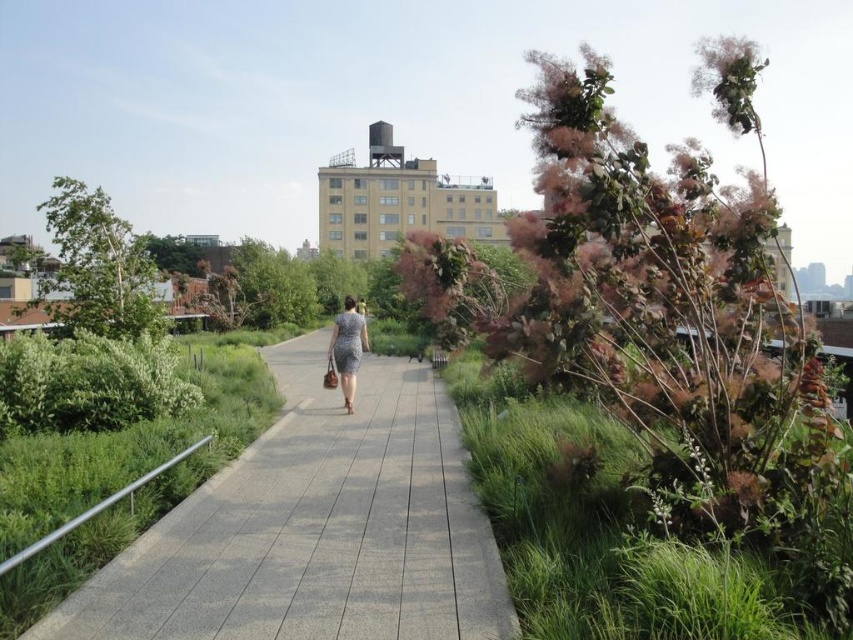
You are a gardener who wants to mow the green grass at right. You notice the patterned fabric dress at center is placed on the ground nearby. Which object is shorter in height?

The green grass at right is not as tall as the patterned fabric dress at center, so the green grass at right is shorter in height.

You are a photographer standing at the center of the paved pathway in the urban park scene. You notice the green grass at right and the patterned fabric dress at center. Which object appears smaller in the image?

The green grass at right appears smaller compared to the patterned fabric dress at center.

You are a gardener who needs to reach the patterned fabric dress at center from the green grass at right. Given that your gardening cart can only move along the paved pathway, which is 24 feet wide, will you be able to reach the dress without deviating from the path?

The distance between the green grass at right and the patterned fabric dress at center is 24.79 feet. Since the pathway is 24 feet wide, the cart cannot navigate the 24.79 feet distance without going beyond the path width. Therefore, you will need to deviate from the path to reach the dress.